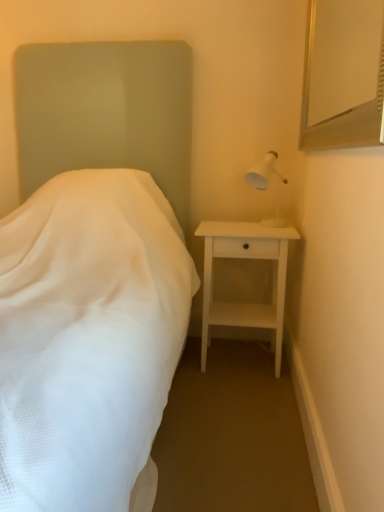
This screenshot has width=384, height=512. Describe the element at coordinates (264, 172) in the screenshot. I see `white plastic lamp at upper right` at that location.

I want to click on white fabric bed at left, so click(88, 340).

Find the location of a particular element. Image resolution: width=384 pixels, height=512 pixels. silver metallic mirror at upper right is located at coordinates (343, 75).

Which object is further away from the camera taking this photo, silver metallic mirror at upper right or white matte nightstand at right?

Positioned behind is white matte nightstand at right.

Is silver metallic mirror at upper right inside the boundaries of white matte nightstand at right, or outside?

silver metallic mirror at upper right is spatially situated outside white matte nightstand at right.

From the image's perspective, is silver metallic mirror at upper right above or below white matte nightstand at right?

silver metallic mirror at upper right is situated higher than white matte nightstand at right in the image.

Is silver metallic mirror at upper right smaller than white matte nightstand at right?

Correct, silver metallic mirror at upper right occupies less space than white matte nightstand at right.

Looking at the image, does silver metallic mirror at upper right seem bigger or smaller compared to white fabric bed at left?

Considering their sizes, silver metallic mirror at upper right takes up less space than white fabric bed at left.

Considering the sizes of objects silver metallic mirror at upper right and white fabric bed at left in the image provided, who is shorter, silver metallic mirror at upper right or white fabric bed at left?

silver metallic mirror at upper right.

Is silver metallic mirror at upper right next to white fabric bed at left and touching it?

They are not placed beside each other.

Is silver metallic mirror at upper right inside the boundaries of white fabric bed at left, or outside?

silver metallic mirror at upper right lies outside white fabric bed at left.

Who is smaller, white plastic lamp at upper right or white fabric bed at left?

With smaller size is white plastic lamp at upper right.

Looking at this image, could you tell me if white plastic lamp at upper right is turned towards white fabric bed at left?

No, white plastic lamp at upper right is not turned towards white fabric bed at left.

Can you see white plastic lamp at upper right touching white fabric bed at left?

No, white plastic lamp at upper right is not with white fabric bed at left.

Is white fabric bed at left located within white plastic lamp at upper right?

No, white fabric bed at left is not a part of white plastic lamp at upper right.

Consider the image. Which of these two, white matte nightstand at right or white plastic lamp at upper right, is wider?

white matte nightstand at right.

Can white plastic lamp at upper right be found inside white matte nightstand at right?

No, white matte nightstand at right does not contain white plastic lamp at upper right.

Between white matte nightstand at right and white plastic lamp at upper right, which one has less height?

With less height is white plastic lamp at upper right.

From the image's perspective, which object appears higher, white plastic lamp at upper right or silver metallic mirror at upper right?

From the image's view, silver metallic mirror at upper right is above.

Locate an element on the screen. This screenshot has width=384, height=512. bedside lamp that is under the silver metallic mirror at upper right (from a real-world perspective) is located at coordinates (264, 172).

Which is in front, point (260, 176) or point (324, 48)?

Point (324, 48)

Is silver metallic mirror at upper right surrounded by white plastic lamp at upper right?

No.

Is white fabric bed at left aimed at white matte nightstand at right?

No.

Based on the photo, from a real-world perspective, is white fabric bed at left located higher than white matte nightstand at right?

Yes, from a real-world perspective, white fabric bed at left is on top of white matte nightstand at right.

From the image's perspective, is white fabric bed at left below white matte nightstand at right?

No.

In the scene shown: Considering the sizes of white fabric bed at left and white matte nightstand at right in the image, is white fabric bed at left taller or shorter than white matte nightstand at right?

Considering their sizes, white fabric bed at left has more height than white matte nightstand at right.

Which is more to the left, white matte nightstand at right or white fabric bed at left?

Positioned to the left is white fabric bed at left.

Considering the points (280, 300) and (116, 185), which point is behind, point (280, 300) or point (116, 185)?

Positioned behind is point (280, 300).

Measure the distance between white matte nightstand at right and white fabric bed at left.

A distance of 55.28 centimeters exists between white matte nightstand at right and white fabric bed at left.

At what (x,y) coordinates should I click in order to perform the action: click on nightstand below the silver metallic mirror at upper right (from a real-world perspective). Please return your answer as a coordinate pair (x, y). This screenshot has width=384, height=512. Looking at the image, I should click on (245, 258).

Identify the location of bed on the left of silver metallic mirror at upper right. (88, 340).

Based on their spatial positions, is white plastic lamp at upper right or white matte nightstand at right closer to white fabric bed at left?

Among the two, white matte nightstand at right is located nearer to white fabric bed at left.

Considering their positions, is white plastic lamp at upper right positioned further to silver metallic mirror at upper right than white fabric bed at left?

white fabric bed at left lies further to silver metallic mirror at upper right than the other object.

Which object lies nearer to the anchor point white fabric bed at left, silver metallic mirror at upper right or white matte nightstand at right?

white matte nightstand at right.

Based on their spatial positions, is silver metallic mirror at upper right or white plastic lamp at upper right further from white fabric bed at left?

silver metallic mirror at upper right is positioned further to the anchor white fabric bed at left.

Looking at the image, which one is located further to silver metallic mirror at upper right, white matte nightstand at right or white plastic lamp at upper right?

white matte nightstand at right lies further to silver metallic mirror at upper right than the other object.

Estimate the real-world distances between objects in this image. Which object is closer to silver metallic mirror at upper right, white matte nightstand at right or white fabric bed at left?

The object closer to silver metallic mirror at upper right is white matte nightstand at right.

From the image, which object appears to be nearer to white matte nightstand at right, white plastic lamp at upper right or silver metallic mirror at upper right?

Among the two, white plastic lamp at upper right is located nearer to white matte nightstand at right.

Estimate the real-world distances between objects in this image. Which object is closer to silver metallic mirror at upper right, white fabric bed at left or white matte nightstand at right?

white matte nightstand at right.

Where is `bedside lamp between silver metallic mirror at upper right and white matte nightstand at right from front to back`? This screenshot has height=512, width=384. bedside lamp between silver metallic mirror at upper right and white matte nightstand at right from front to back is located at coordinates (264, 172).

The width and height of the screenshot is (384, 512). I want to click on bedside lamp located between white fabric bed at left and white matte nightstand at right in the depth direction, so click(x=264, y=172).

The width and height of the screenshot is (384, 512). In order to click on mirror between white fabric bed at left and white plastic lamp at upper right in the front-back direction in this screenshot , I will do `click(343, 75)`.

I want to click on mirror positioned between white fabric bed at left and white matte nightstand at right from near to far, so click(343, 75).